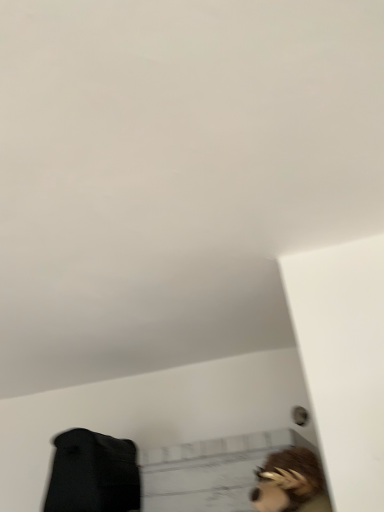
Describe the element at coordinates (93, 474) in the screenshot. I see `black fabric bag at lower left` at that location.

What is the approximate width of black fabric bag at lower left?

black fabric bag at lower left is 11.28 inches in width.

In order to click on black fabric bag at lower left in this screenshot , I will do `click(93, 474)`.

In order to face black fabric bag at lower left, should I rotate leftwards or rightwards?

Rotate left and turn 14.338 degrees.

You are a GUI agent. You are given a task and a screenshot of the screen. Output one action in this format:
    pyautogui.click(x=<x>, y=<y>)
    Task: Click on the black fabric bag at lower left
    The width and height of the screenshot is (384, 512).
    Given the screenshot: What is the action you would take?
    pyautogui.click(x=93, y=474)